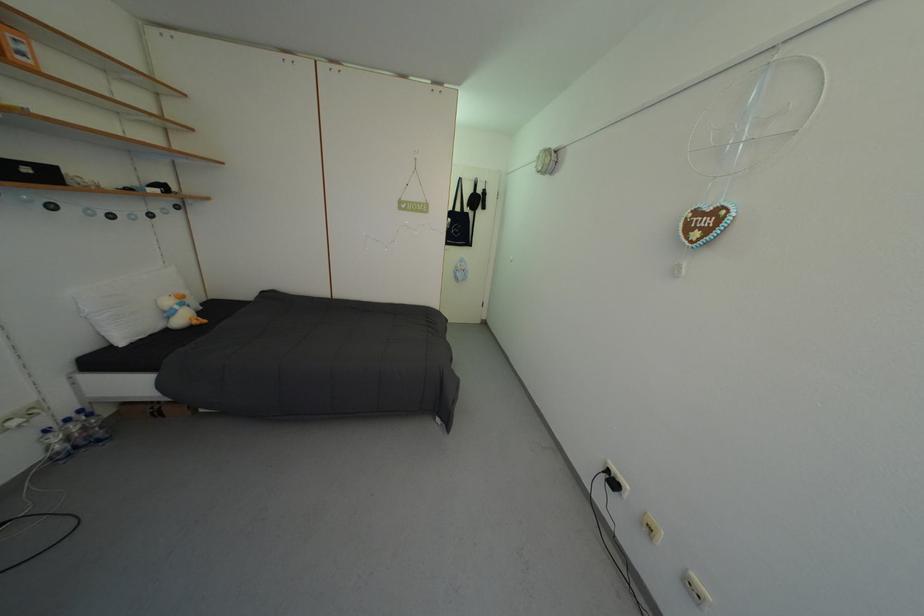
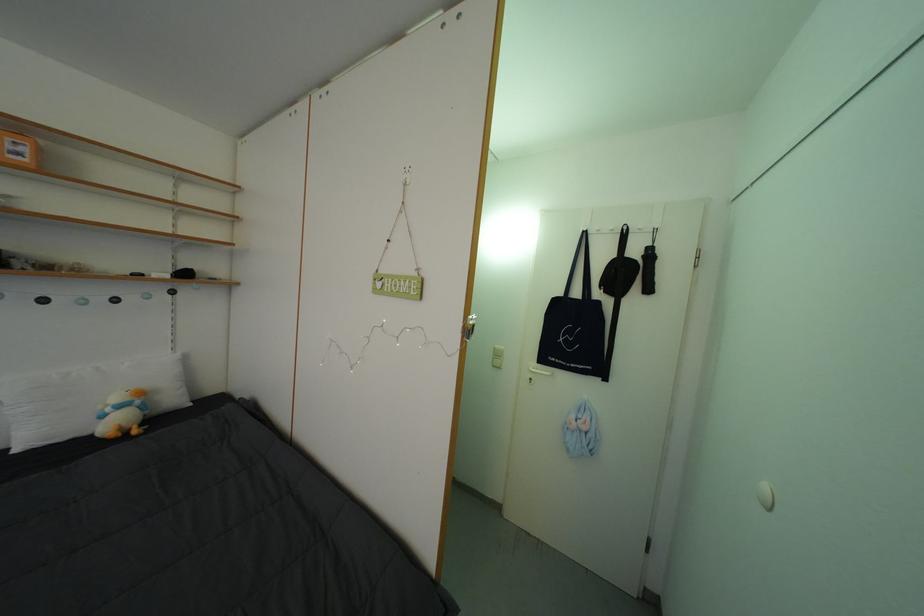
In the second image, find the point that corresponds to (x=488, y=197) in the first image.

(642, 257)